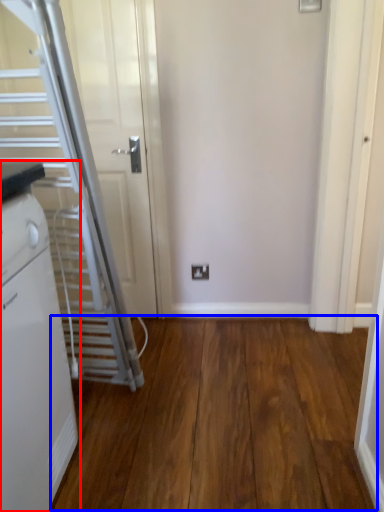
Question: Which object is closer to the camera taking this photo, home appliance (highlighted by a red box) or hardwood (highlighted by a blue box)?

Choices:
 (A) home appliance
 (B) hardwood

Answer: (A)